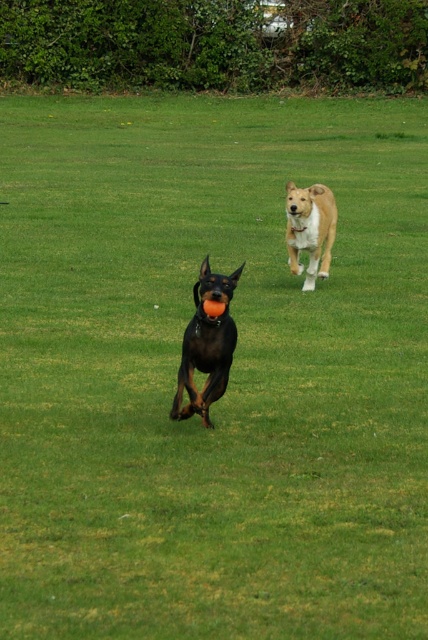
You are a photographer trying to capture both dogs in a single shot. Given that the shiny black dog at center is closer to the camera than the light brown fur at center, which dog would appear larger in the photo?

The shiny black dog at center would appear larger in the photo because it is closer to the camera than the light brown fur at center.

You are standing at the origin point in the image. The shiny black dog at center is at point (207, 346). If you want to walk directly to the shiny black dog at center, which direction should you move in terms of the coordinate system?

To reach the shiny black dog at center located at point (207, 346) from the origin, you should move in the positive x and positive y direction since both coordinates are greater than 0.

You are a photographer standing at the edge of the grassy field. You want to take a picture of both the shiny black dog at center and the light brown fur at center. If you need to ensure that both dogs fit in the frame, which dog requires more space horizontally?

The light brown fur at center requires more space horizontally because its width is greater than the shiny black dog at center.